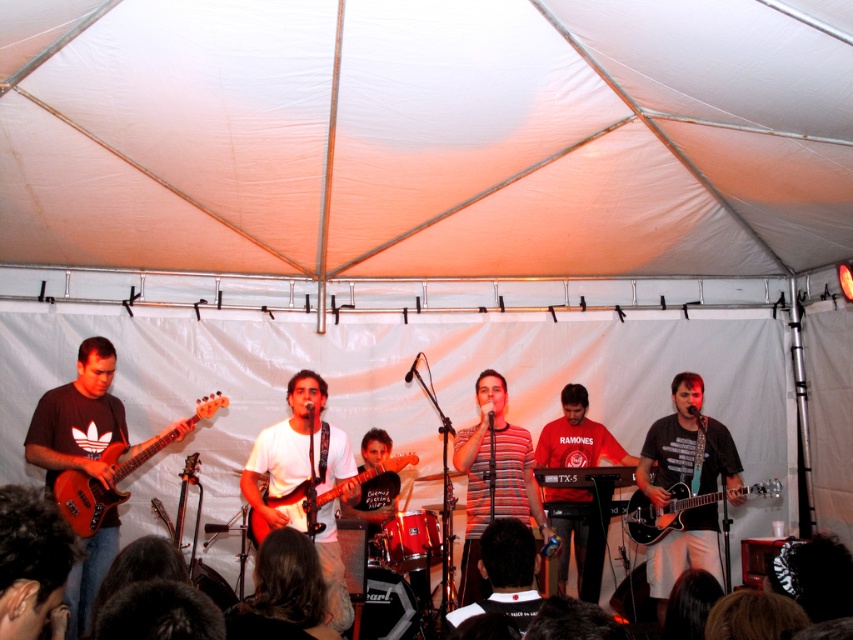
Which is more to the left, matte wood electric guitar at left or shiny black electric guitar at center?

matte wood electric guitar at left

Can you confirm if matte wood electric guitar at left is bigger than shiny black electric guitar at center?

Correct, matte wood electric guitar at left is larger in size than shiny black electric guitar at center.

What do you see at coordinates (100, 484) in the screenshot? This screenshot has height=640, width=853. I see `matte wood electric guitar at left` at bounding box center [100, 484].

Where is `matte wood electric guitar at left`? matte wood electric guitar at left is located at coordinates (100, 484).

Is point (53, 406) farther from camera compared to point (107, 486)?

Yes, it is.

How far apart are matte black guitar at left and matte wood electric guitar at left?

matte black guitar at left is 6.86 inches from matte wood electric guitar at left.

What do you see at coordinates (78, 417) in the screenshot? The height and width of the screenshot is (640, 853). I see `matte black guitar at left` at bounding box center [78, 417].

Find the location of `matte black guitar at left`. matte black guitar at left is located at coordinates (78, 417).

Who is positioned more to the right, matte wood electric guitar at center or shiny black electric guitar at center?

Positioned to the right is shiny black electric guitar at center.

Identify the location of matte wood electric guitar at center. (328, 492).

At what (x,y) coordinates should I click in order to perform the action: click on matte wood electric guitar at center. Please return your answer as a coordinate pair (x, y). The image size is (853, 640). Looking at the image, I should click on (328, 492).